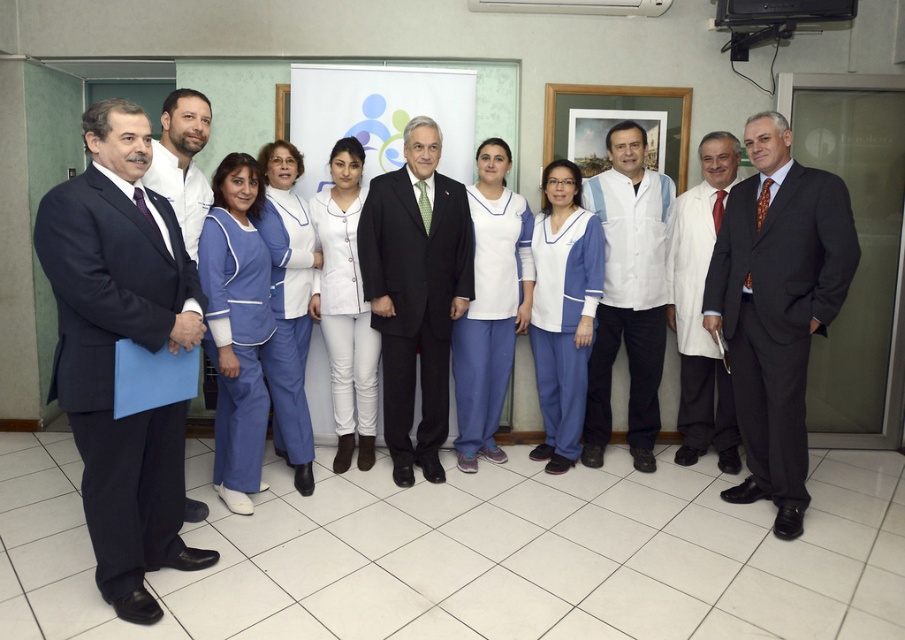
Question: Does white lab coat at center have a lesser width compared to white matte uniform at center?

Choices:
 (A) no
 (B) yes

Answer: (A)

Question: Which of the following is the farthest from the observer?

Choices:
 (A) (291, 289)
 (B) (359, 376)
 (C) (435, 275)
 (D) (653, 467)

Answer: (D)

Question: Estimate the real-world distances between objects in this image. Which object is closer to the matte white coat at left?

Choices:
 (A) matte blue scrubs at center
 (B) white fabric coat at center

Answer: (A)

Question: Is dark blue suit at left smaller than white lab coat at right?

Choices:
 (A) no
 (B) yes

Answer: (A)

Question: Which of the following is the closest to the observer?

Choices:
 (A) (272, 150)
 (B) (708, 204)
 (C) (580, 220)

Answer: (A)

Question: Is blue scrubs at center bigger than white matte uniform at center?

Choices:
 (A) yes
 (B) no

Answer: (B)